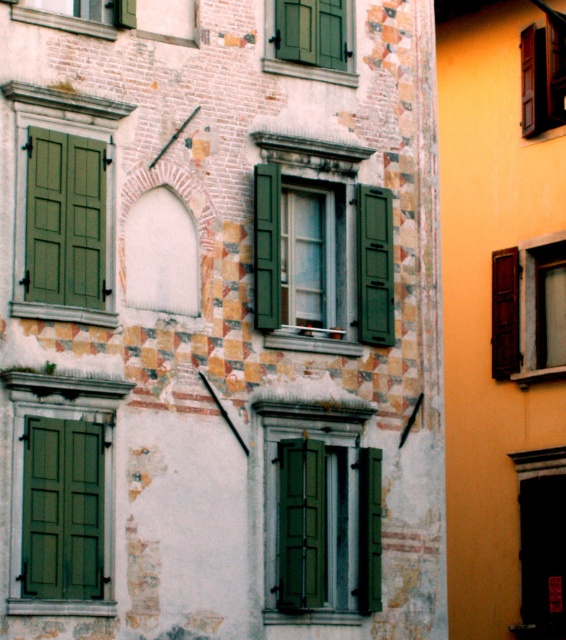
You are standing in front of a historic building with a mix of brick and decorative stucco walls. You notice a green wood window at center. If you want to take a photo of this window from where you are standing, will you be able to capture the entire window in a single shot without zooming in? Please consider the distance between you and the window.

The distance between the green wood window at center and the camera is 50.97 meters. At this distance, capturing the entire window in a single shot without zooming in would depend on the camera lens used. However, given the significant distance, it is likely that the window would appear small in the frame, making it necessary to zoom in for a clear view. Therefore, you might not be able to capture the entire window without zooming in.

You are an architect analyzing the building facade. You notice two windows at the center labeled as green wood window at center and green matte window at center. Which one has a greater width?

The green wood window at center has a greater width than the green matte window at center according to the description.

From the picture: You are a painter who needs to place a ladder between the green wood window at center and the green wooden shutters at upper center to reach both. What is the minimum length of ladder needed to reach both?

The minimum length of ladder needed to reach both the green wood window at center and the green wooden shutters at upper center is 2.58 meters, as they are 2.58 meters apart from each other.